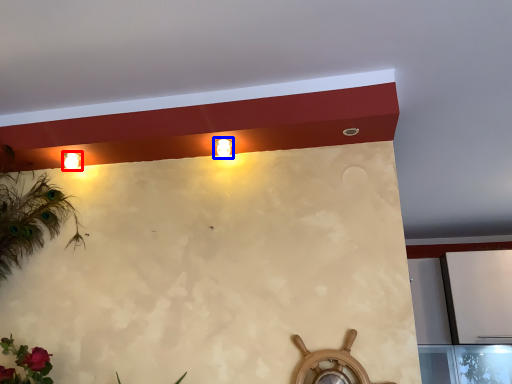
Question: Among these objects, which one is nearest to the camera, lamp (highlighted by a red box) or fixture (highlighted by a blue box)?

Choices:
 (A) lamp
 (B) fixture

Answer: (B)